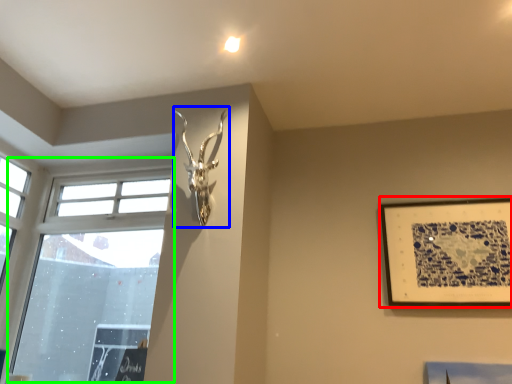
Question: Estimate the real-world distances between objects in this image. Which object is farther from picture frame (highlighted by a red box), sculpture (highlighted by a blue box) or window (highlighted by a green box)?

Choices:
 (A) sculpture
 (B) window

Answer: (B)